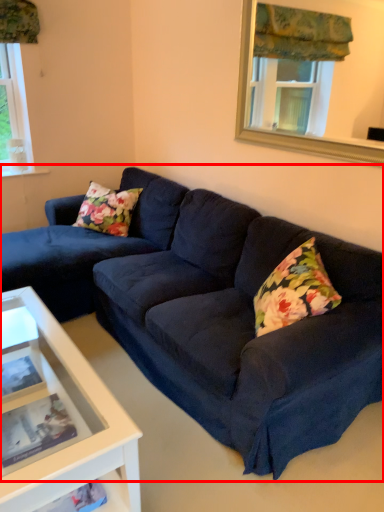
Question: From the image's perspective, considering the relative positions of studio couch (annotated by the red box) and window frame in the image provided, where is studio couch (annotated by the red box) located with respect to the staircase?

Choices:
 (A) above
 (B) below

Answer: (B)